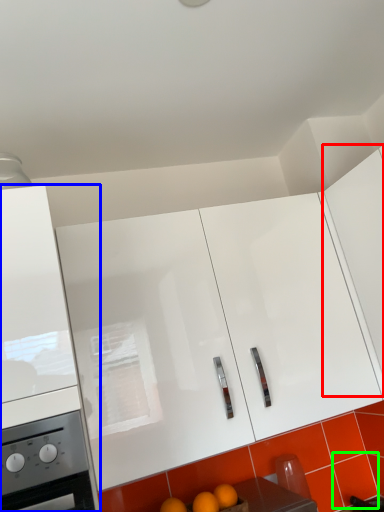
Question: Which object is the closest to the cabinetry (highlighted by a red box)? Choose among these: cabinetry (highlighted by a blue box) or tile (highlighted by a green box).

Choices:
 (A) cabinetry
 (B) tile

Answer: (B)